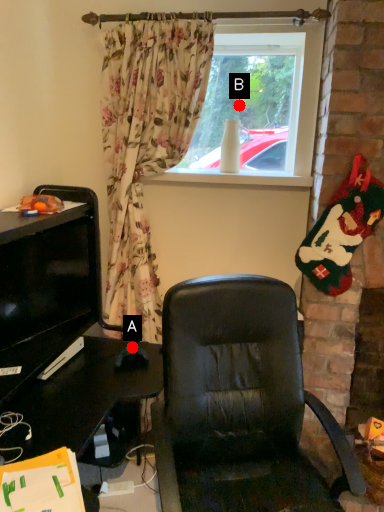
Question: Two points are circled on the image, labeled by A and B beside each circle. Which point appears farthest from the camera in this image?

Choices:
 (A) A is further
 (B) B is further

Answer: (B)